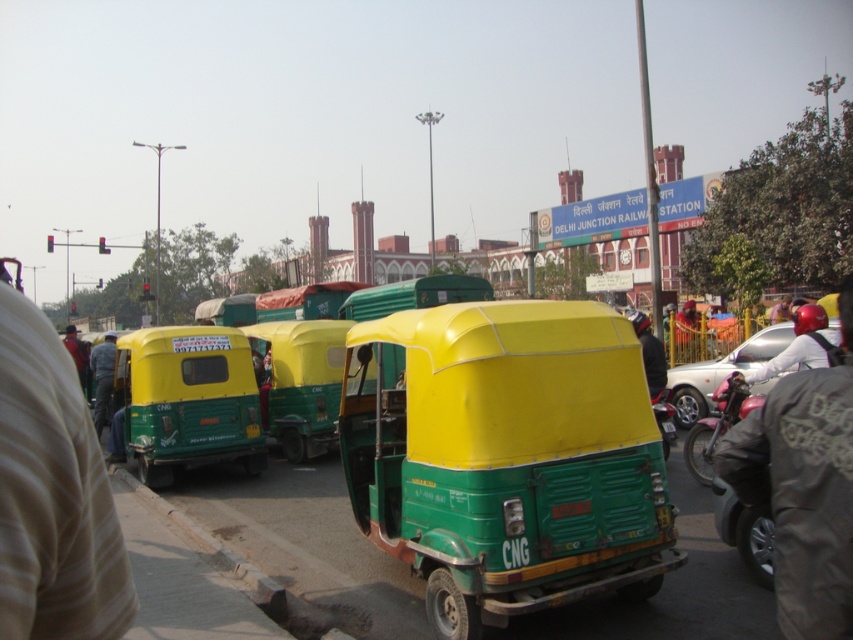
Does shiny red motorcycle at right have a smaller size compared to red fabric jacket at left?

Correct, shiny red motorcycle at right occupies less space than red fabric jacket at left.

Is point (743, 381) behind point (80, 356)?

No, it is in front of (80, 356).

Locate an element on the screen. shiny red motorcycle at right is located at coordinates (717, 424).

Between metallic silver car at right and green matte auto-rickshaw at left, which one has less height?

metallic silver car at right

Is metallic silver car at right positioned before green matte auto-rickshaw at left?

No, it is not.

Is point (708, 362) behind point (97, 408)?

Yes.

At what (x,y) coordinates should I click in order to perform the action: click on metallic silver car at right. Please return your answer as a coordinate pair (x, y). Looking at the image, I should click on (722, 371).

The height and width of the screenshot is (640, 853). Describe the element at coordinates (722, 371) in the screenshot. I see `metallic silver car at right` at that location.

Is metallic silver car at right smaller than red fabric jacket at left?

Yes, metallic silver car at right is smaller than red fabric jacket at left.

At what (x,y) coordinates should I click in order to perform the action: click on metallic silver car at right. Please return your answer as a coordinate pair (x, y). The width and height of the screenshot is (853, 640). Looking at the image, I should click on (722, 371).

I want to click on metallic silver car at right, so click(x=722, y=371).